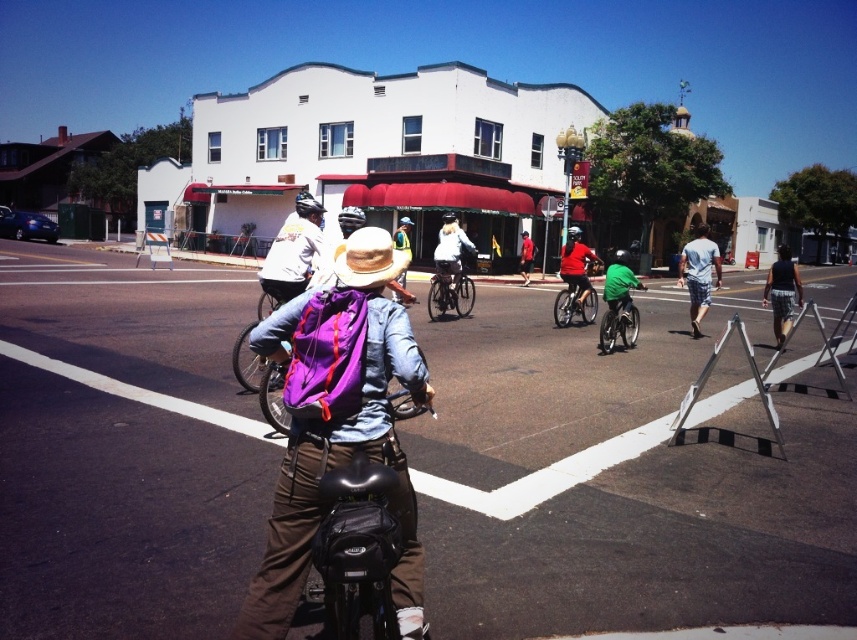
You are a delivery person standing at the edge of the street. You need to place the purple fabric backpack at center onto the shiny metallic bicycle at center. Given that the backpack weighs 5 kilograms and the bicycle can carry up to 10 kilograms, can you safely place the backpack on the bicycle without exceeding its weight limit?

The purple fabric backpack at center weighs 5 kilograms, which is within the shiny metallic bicycle at center 10 kilograms weight capacity. Therefore, you can safely place the purple fabric backpack at center onto the shiny metallic bicycle at center without exceeding its weight limit.